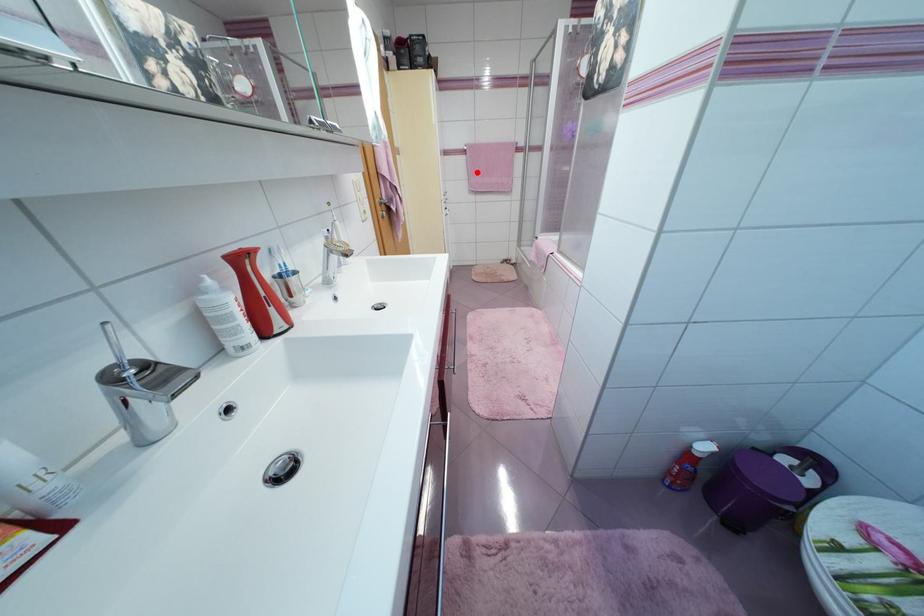
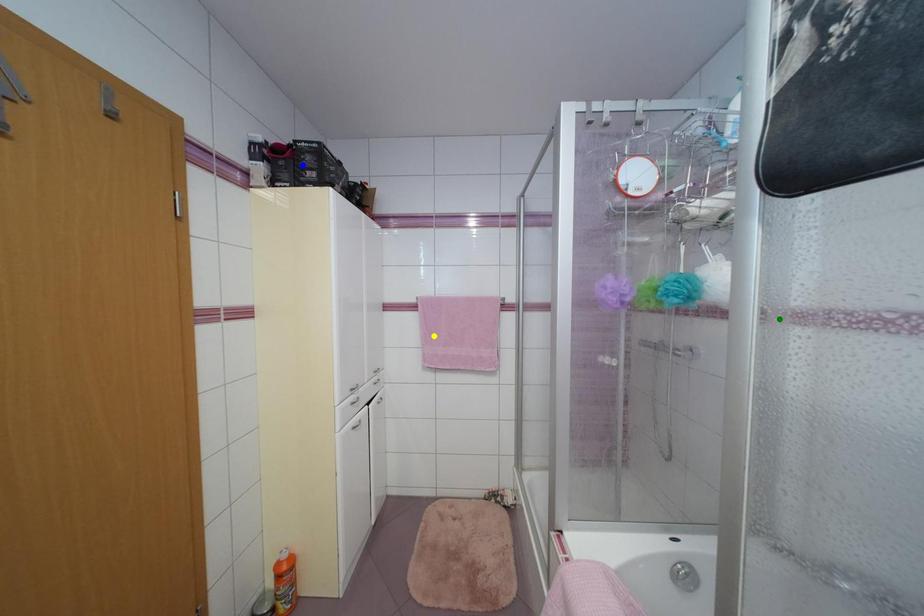
Question: I am providing you with two images of the same scene from different viewpoints. A red point is marked on the first image. You are given multiple points on the second image. Which point in image 2 is actually the same real-world point as the red point in image 1?

Choices:
 (A) blue point
 (B) yellow point
 (C) green point

Answer: (B)